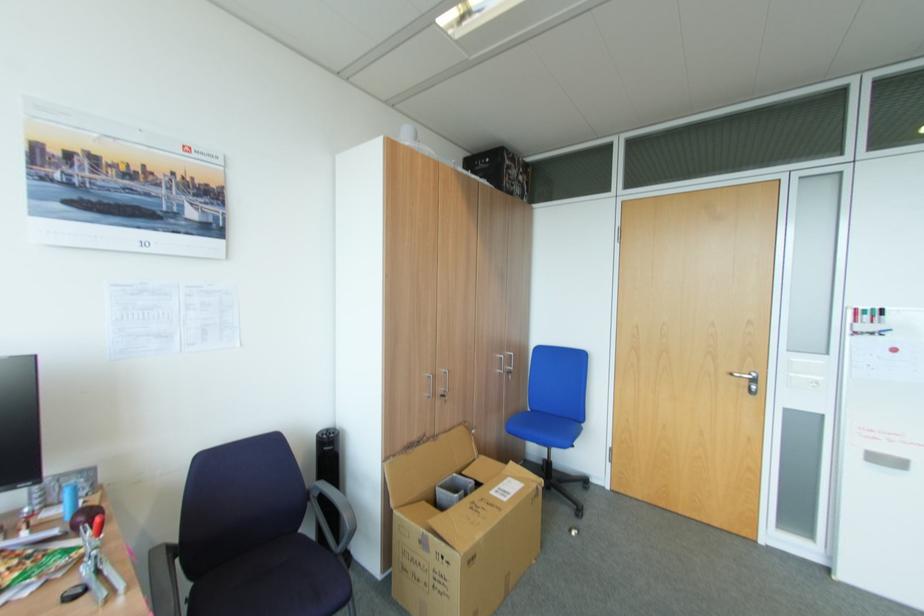
Identify the location of black box. (501, 169).